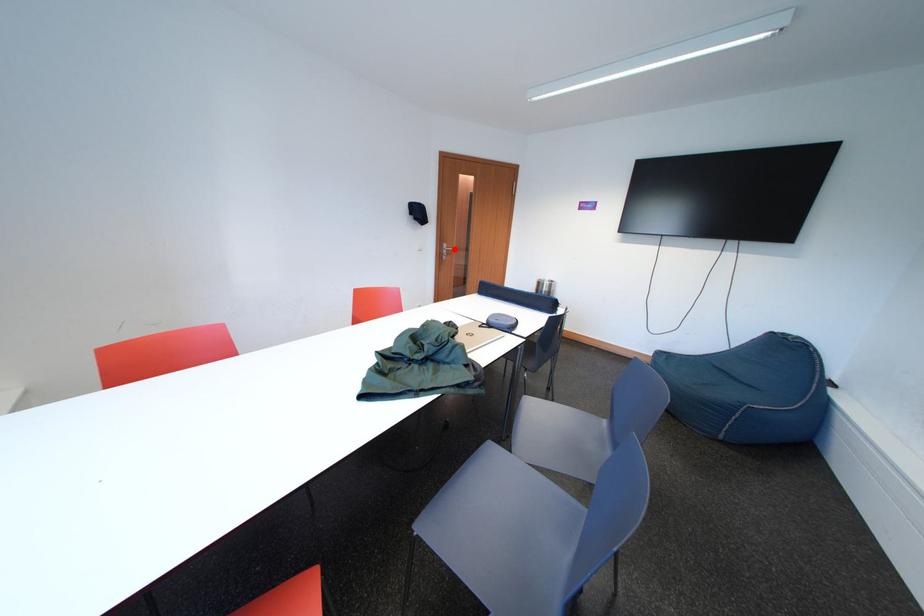
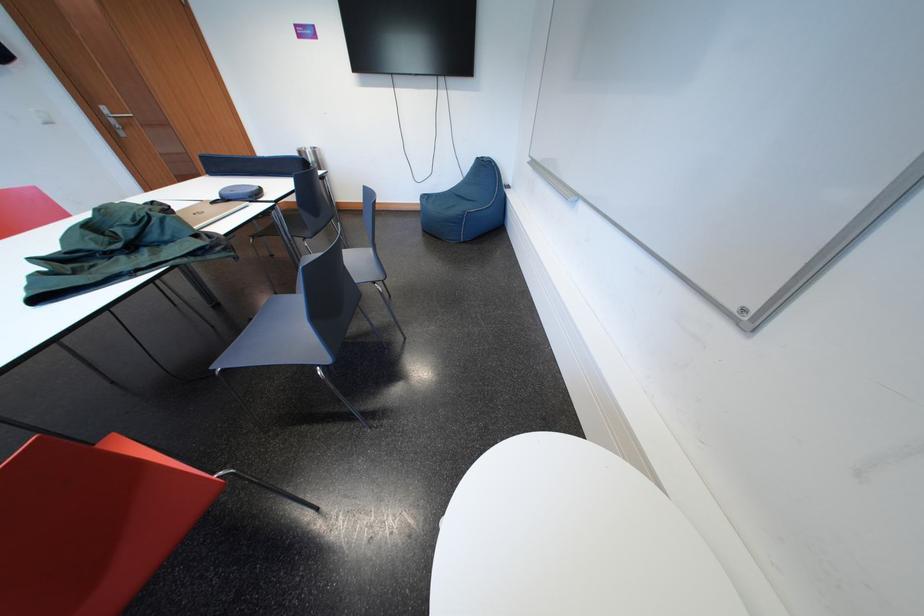
The point at the highlighted location is marked in the first image. Where is the corresponding point in the second image?

(113, 113)